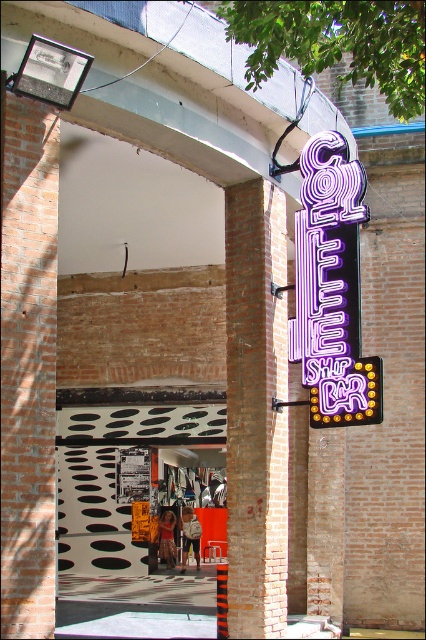
You are standing at the entrance of the coffee shop bar and want to hang a new decorative banner that is 2 meters tall. The banner needs to be placed above the entrance but must not block the neon purple sign at right. Given the height of the brick at center, can the banner be safely hung without covering the sign?

The brick at center is much taller than the neon purple sign at right, so the banner can be safely hung above the entrance without covering the sign since the brick at center provides sufficient vertical space.

You are a delivery person carrying a box that is 1.2 meters wide. You need to walk through the entrance between the brick at center and the neon purple sign at right. Will your box fit through the entrance?

The distance between the brick at center and the neon purple sign at right is 1.10 meters. Since your box is 1.2 meters wide, it will not fit through the entrance.

You are standing in front of the coffee shop bar entrance. Where exactly is the brick at center located in the image?

The brick at center is located at point coordinates of (256, 410).